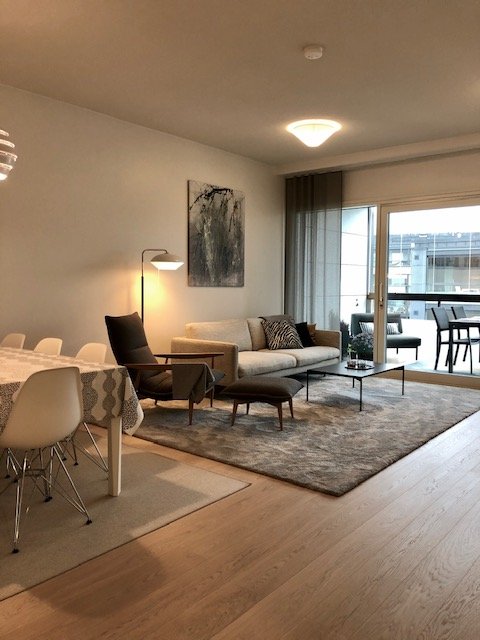
At what (x,y) coordinates should I click in order to perform the action: click on apartment view. Please return your answer as a coordinate pair (x, y). Looking at the image, I should click on (224, 473).